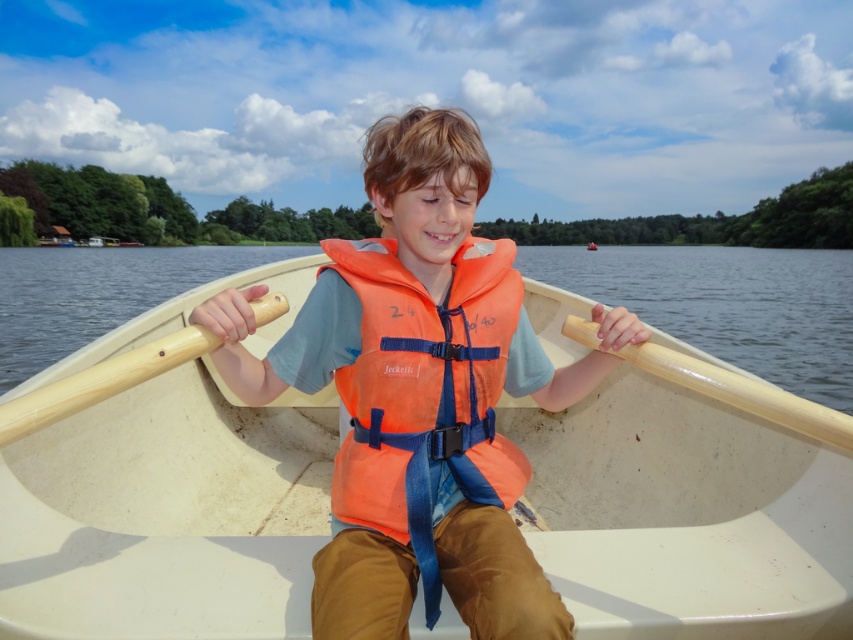
You are a drone operator trying to capture a photo of the boy in the rowboat. The drone is currently hovering at point (728, 305). What is the condition of the area at your current position?

The area at point (728, 305) is transparent water at center, so the drone can safely pass through it.

You are standing on the dock and want to check if the orange life vest at center is within reach. The maximum distance you can safely reach is 1 meter. Can you reach it?

The orange life vest at center is 99.73 centimeters away from the viewer. Since 99.73 centimeters is less than 1 meter, you can safely reach it.

You are a safety inspector checking the boat setup. The orange life vest at center and the wooden paddle at left must be positioned correctly. According to safety regulations, the life vest should always be placed below the paddle for easy access. Is the current arrangement compliant with safety standards?

The orange life vest at center is located above the wooden paddle at left, which violates safety regulations because the life vest should be placed below the paddle for easy access. The current arrangement is not compliant.